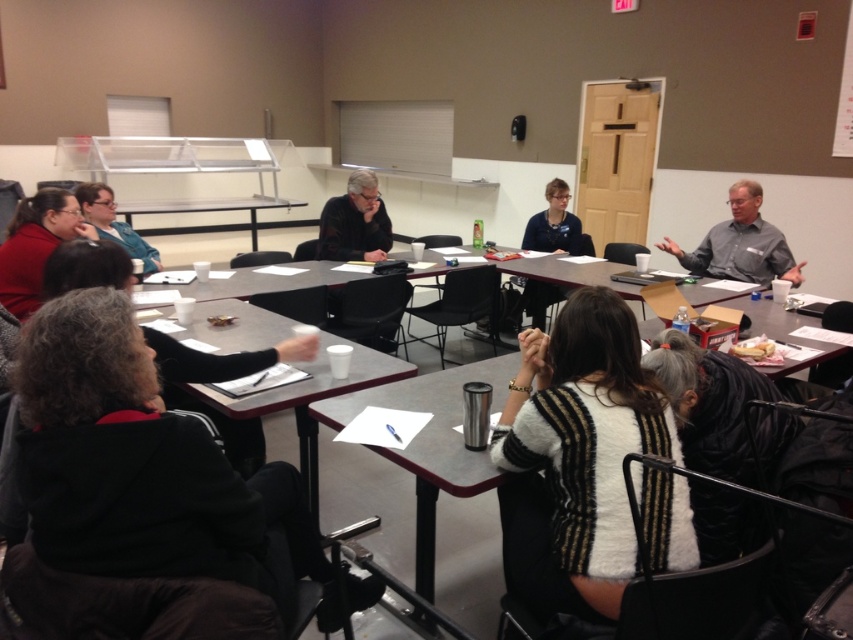
You are standing in the conference room and need to retrieve your black fleece jacket at lower left. The whiteboard is on the right side of the frame. Can you walk directly to the jacket without passing by the whiteboard?

The black fleece jacket at lower left is located at point (143,467). Since the whiteboard is on the right side of the frame, the jacket is positioned to the lower left, so you can walk directly to it without passing by the whiteboard.

You are a photographer standing in the conference room. You need to take a photo that includes both the black fleece jacket at lower left and the gray shirt at upper right. Which object should you position closer to the left side of the camera frame to ensure both are visible?

To include both the black fleece jacket at lower left and the gray shirt at upper right in the photo, position the black fleece jacket at lower left closer to the left side of the camera frame since it is already to the left of the gray shirt at upper right.

You are standing at the entrance of the conference room and notice a black fleece jacket at lower left. Where is the black fleece jacket located in relation to the room?

The black fleece jacket at lower left is located at point 0.730 on the x axis and 0.169 on the y axis.